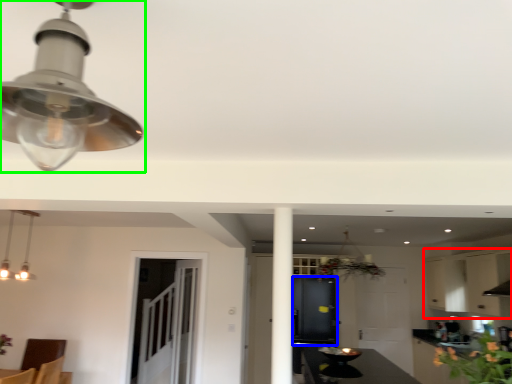
Question: Which is nearer to the cabinetry (highlighted by a red box)? cabinetry (highlighted by a blue box) or lamp (highlighted by a green box).

Choices:
 (A) cabinetry
 (B) lamp

Answer: (A)